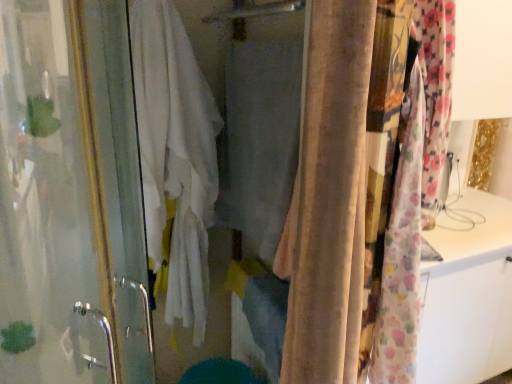
Question: Does white cotton bath towel at center have a greater width compared to transparent glass screen door at left?

Choices:
 (A) yes
 (B) no

Answer: (B)

Question: Is white cotton bath towel at center facing towards transparent glass screen door at left?

Choices:
 (A) no
 (B) yes

Answer: (A)

Question: Considering the relative sizes of white cotton bath towel at center and transparent glass screen door at left in the image provided, is white cotton bath towel at center thinner than transparent glass screen door at left?

Choices:
 (A) yes
 (B) no

Answer: (A)

Question: Would you say white cotton bath towel at center is outside transparent glass screen door at left?

Choices:
 (A) yes
 (B) no

Answer: (A)

Question: From the image's perspective, is white cotton bath towel at center located above transparent glass screen door at left?

Choices:
 (A) no
 (B) yes

Answer: (B)

Question: Considering the relative sizes of white cotton bath towel at center and transparent glass screen door at left in the image provided, is white cotton bath towel at center smaller than transparent glass screen door at left?

Choices:
 (A) yes
 (B) no

Answer: (A)

Question: Is fluffy floral fabric at right, placed as the 2th curtain when sorted from left to right, facing away from beige velvet curtain at center, the 2th curtain from the right?

Choices:
 (A) yes
 (B) no

Answer: (B)

Question: Considering the relative sizes of fluffy floral fabric at right, placed as the 2th curtain when sorted from left to right, and beige velvet curtain at center, the 1th curtain when ordered from left to right, in the image provided, is fluffy floral fabric at right, placed as the 2th curtain when sorted from left to right, thinner than beige velvet curtain at center, the 1th curtain when ordered from left to right,?

Choices:
 (A) no
 (B) yes

Answer: (A)

Question: Considering the relative sizes of fluffy floral fabric at right, placed as the 2th curtain when sorted from left to right, and beige velvet curtain at center, the 2th curtain from the right, in the image provided, is fluffy floral fabric at right, placed as the 2th curtain when sorted from left to right, wider than beige velvet curtain at center, the 2th curtain from the right,?

Choices:
 (A) yes
 (B) no

Answer: (A)

Question: Is fluffy floral fabric at right, placed as the 2th curtain when sorted from left to right, positioned beyond the bounds of beige velvet curtain at center, the 1th curtain when ordered from left to right?

Choices:
 (A) no
 (B) yes

Answer: (B)

Question: Could you tell me if fluffy floral fabric at right, acting as the first curtain starting from the right, is facing beige velvet curtain at center, the 2th curtain from the right?

Choices:
 (A) no
 (B) yes

Answer: (A)

Question: Can you confirm if fluffy floral fabric at right, acting as the first curtain starting from the right, is smaller than beige velvet curtain at center, the 2th curtain from the right?

Choices:
 (A) no
 (B) yes

Answer: (A)

Question: Is fluffy floral fabric at right, placed as the 2th curtain when sorted from left to right, positioned in front of transparent glass screen door at left?

Choices:
 (A) no
 (B) yes

Answer: (A)